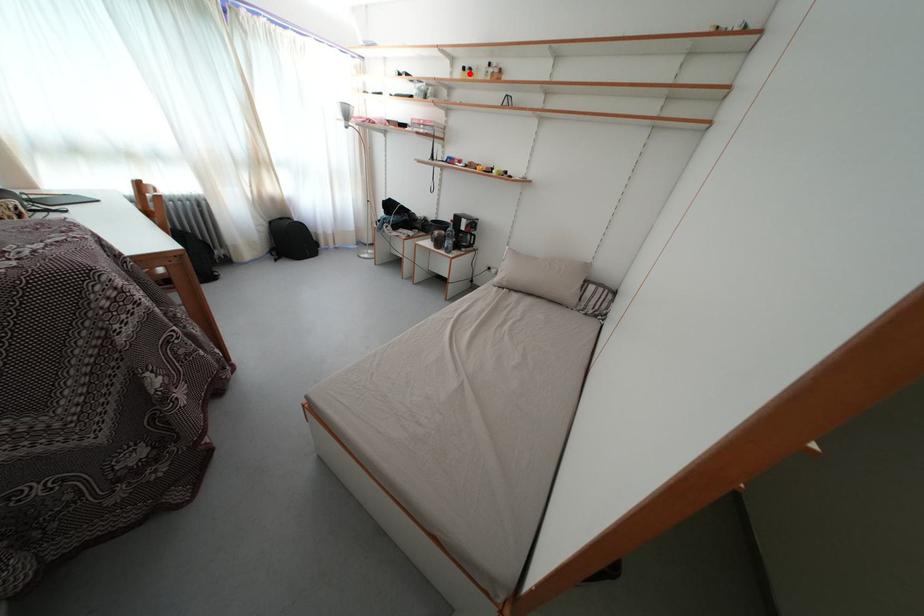
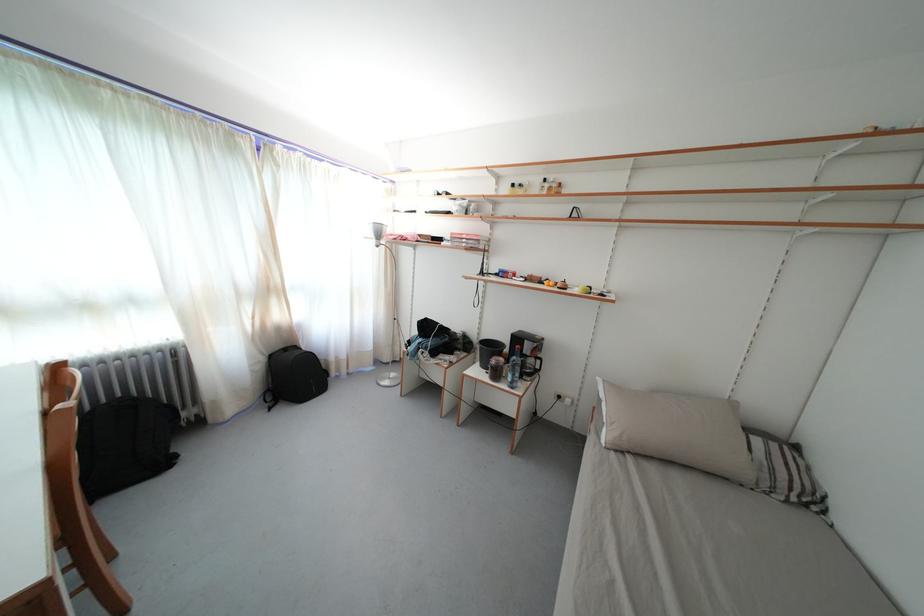
The point at the highlighted location is marked in the first image. Where is the corresponding point in the second image?

(518, 191)